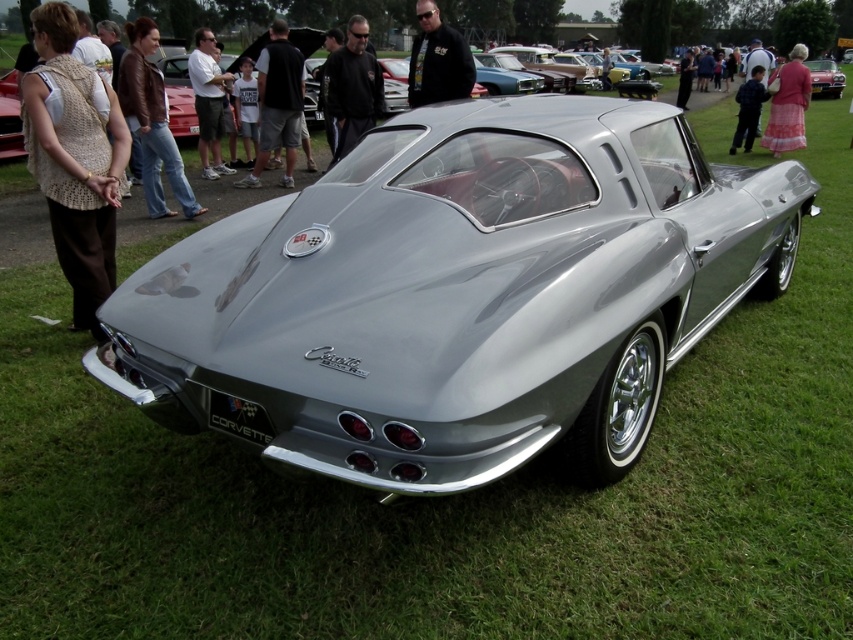
Question: Among these objects, which one is nearest to the camera?

Choices:
 (A) brown leather jacket at upper left
 (B) black leather jacket at center
 (C) knitted beige vest at left
 (D) pink fabric dress at upper right

Answer: (C)

Question: Which object is the closest to the black cotton t-shirt at center?

Choices:
 (A) satin silver car at center
 (B) blue denim jeans at center
 (C) knitted beige vest at left
 (D) brown leather jacket at upper left

Answer: (D)

Question: Which of these objects is positioned farthest from the pink fabric dress at upper right?

Choices:
 (A) satin silver car at center
 (B) black cotton t-shirt at center
 (C) brown leather jacket at upper left
 (D) black leather jacket at center

Answer: (C)

Question: Does black matte jacket at center have a greater width compared to silver metallic car at center?

Choices:
 (A) no
 (B) yes

Answer: (A)

Question: Does black leather jacket at center appear under silver metallic car at center?

Choices:
 (A) yes
 (B) no

Answer: (A)

Question: Can you confirm if black leather jacket at center is positioned to the left of silver metallic car at center?

Choices:
 (A) no
 (B) yes

Answer: (B)